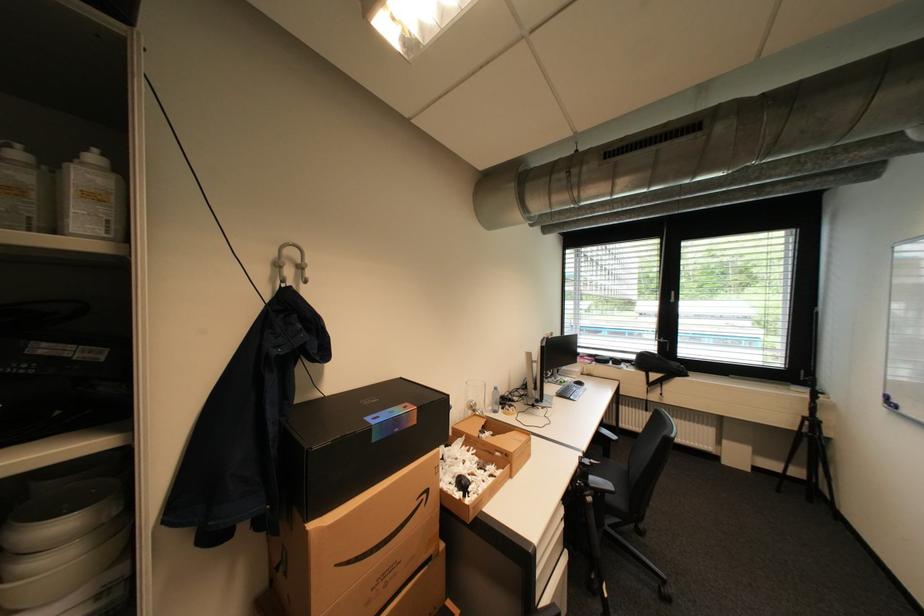
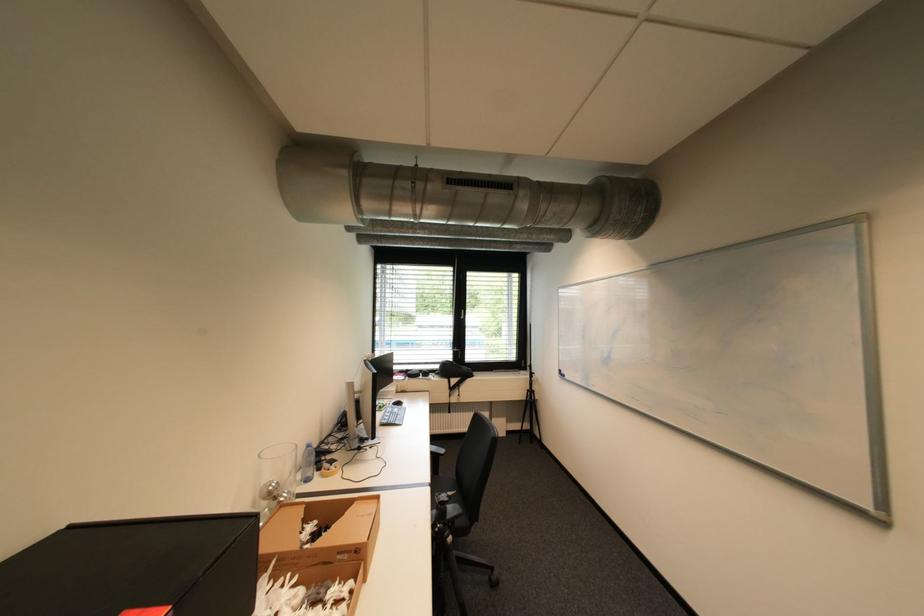
Where in the second image is the point corresponding to (x=502, y=389) from the first image?

(313, 448)